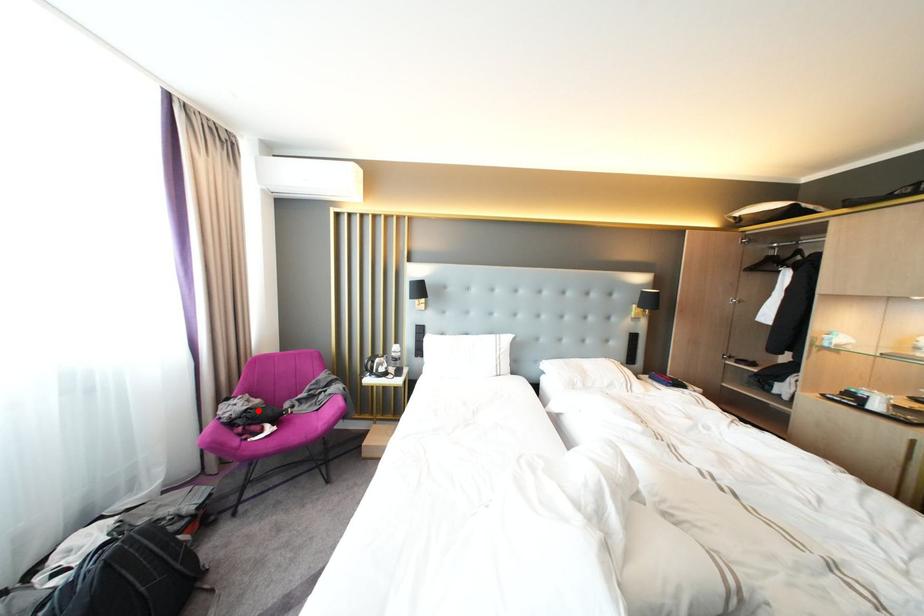
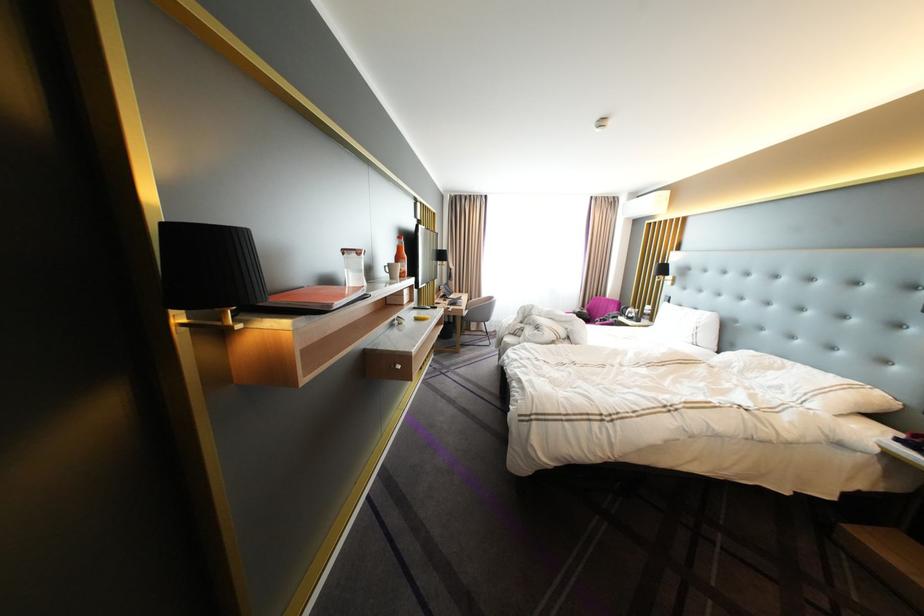
Question: I am providing you with two images of the same scene from different viewpoints. A red point is shown in image1. For the corresponding object point in image2, is it positioned nearer or farther from the camera?

Choices:
 (A) Nearer
 (B) Farther

Answer: (B)